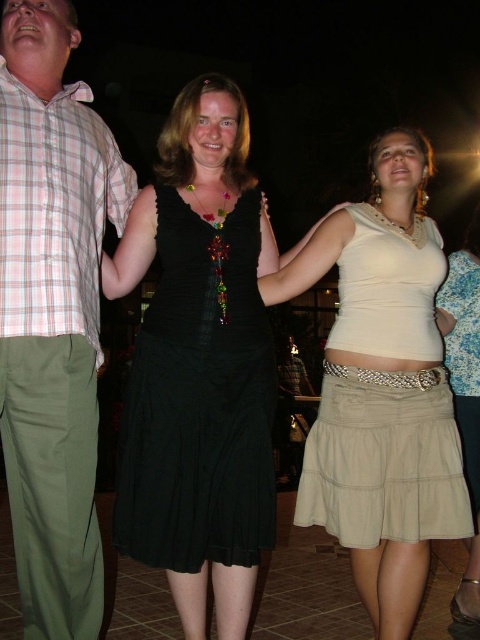
You are at a party and want to take a photo of the two points in the image. Which point, point 1 at coordinates (348, 301) or point 2 at coordinates (94, 164), is closer to the camera?

Point 2 at coordinates (94, 164) is closer to the camera than point 1 at coordinates (348, 301).

Consider the image. You are at a party and want to approach the plaid cotton shirt at left and the beige cotton skirt at lower right. Which one should you walk towards first if you want to greet them in the order they are positioned from closest to farthest from you?

You should first greet the plaid cotton shirt at left because it is closer to you than the beige cotton skirt at lower right.